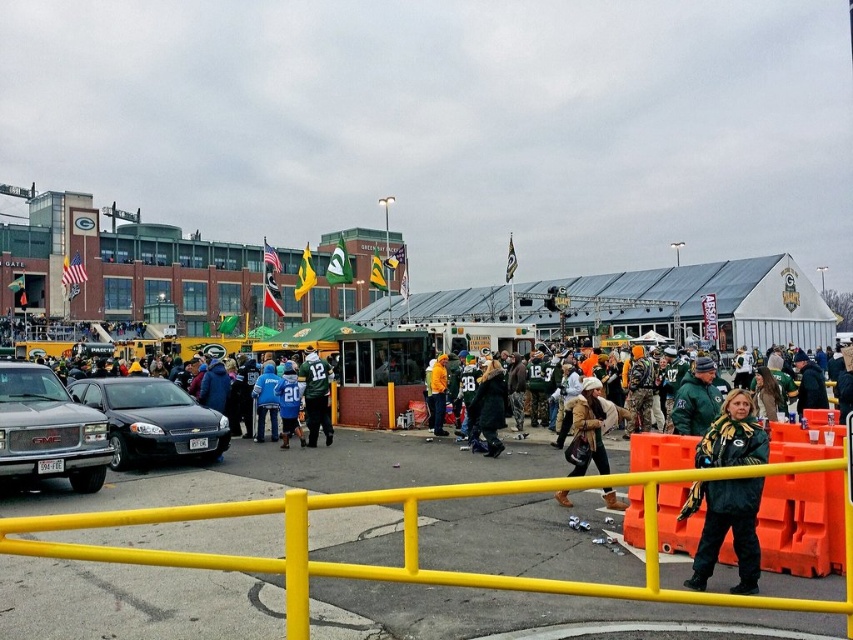
Question: Does black fuzzy coat at center have a larger size compared to blue fabric jacket at center?

Choices:
 (A) no
 (B) yes

Answer: (B)

Question: Which object appears farthest from the camera in this image?

Choices:
 (A) green wool scarf at center
 (B) green fabric scarf at center
 (C) green matte jersey at center

Answer: (C)

Question: Observing the image, what is the correct spatial positioning of green fabric scarf at center in reference to green matte jersey at center?

Choices:
 (A) below
 (B) above

Answer: (B)

Question: From the image, what is the correct spatial relationship of matte black sedan at center-left in relation to blue matte jersey at center?

Choices:
 (A) below
 (B) above

Answer: (B)

Question: Which point appears closest to the camera in this image?

Choices:
 (A) (22, 433)
 (B) (579, 465)
 (C) (699, 502)

Answer: (C)

Question: Among these points, which one is farthest from the camera?

Choices:
 (A) (260, 428)
 (B) (442, 433)

Answer: (B)